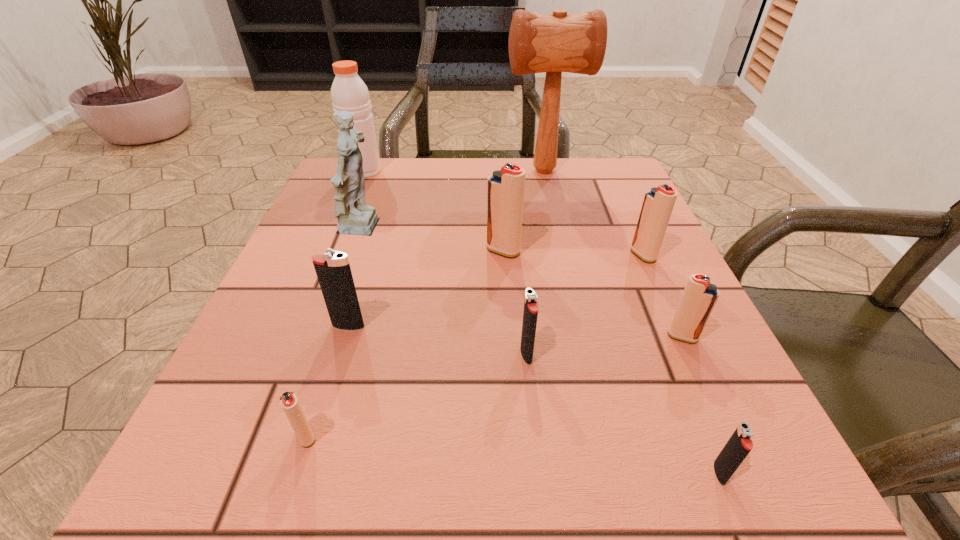
What are the coordinates of `vacant region located 0.280m on the right of the fourth tallest object` in the screenshot? It's located at (665, 251).

This screenshot has height=540, width=960. Identify the location of vacant space positioned on the front of the second biggest red igniter. (674, 323).

The width and height of the screenshot is (960, 540). Find the location of `vacant region located on the right of the leftmost black igniter`. vacant region located on the right of the leftmost black igniter is located at coordinates (428, 326).

Find the location of `vacant area situated 0.080m on the right of the second black igniter from left to right`. vacant area situated 0.080m on the right of the second black igniter from left to right is located at coordinates (586, 354).

You are a GUI agent. You are given a task and a screenshot of the screen. Output one action in this format:
    pyautogui.click(x=<x>, y=<y>)
    Task: Click on the vacant space located on the back of the second nearest red igniter
    This screenshot has width=960, height=540.
    Given the screenshot: What is the action you would take?
    pyautogui.click(x=632, y=225)

You are a GUI agent. You are given a task and a screenshot of the screen. Output one action in this format:
    pyautogui.click(x=<x>, y=<y>)
    Task: Click on the vacant space located 0.110m on the right of the second nearest igniter
    The height and width of the screenshot is (540, 960).
    Given the screenshot: What is the action you would take?
    pyautogui.click(x=404, y=437)

Where is `free location located 0.300m on the left of the rightmost black igniter`? This screenshot has height=540, width=960. free location located 0.300m on the left of the rightmost black igniter is located at coordinates (461, 472).

Find the location of a particular element. The width and height of the screenshot is (960, 540). mallet positioned at the far edge is located at coordinates (554, 43).

Where is `shaker at the far edge`? shaker at the far edge is located at coordinates (349, 93).

In order to click on shaker present at the left edge in this screenshot , I will do `click(349, 93)`.